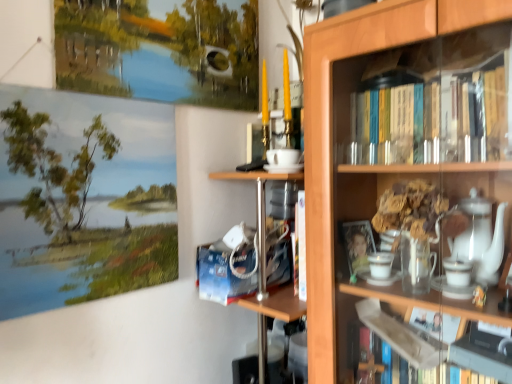
Question: Should I look upward or downward to see oil painting landscape at upper left?

Choices:
 (A) up
 (B) down

Answer: (B)

Question: Does wooden bookcase at upper right have a greater height compared to oil painting landscape at upper left?

Choices:
 (A) yes
 (B) no

Answer: (A)

Question: From a real-world perspective, is wooden bookcase at upper right under oil painting landscape at upper left?

Choices:
 (A) yes
 (B) no

Answer: (A)

Question: Is wooden bookcase at upper right positioned beyond the bounds of oil painting landscape at upper left?

Choices:
 (A) yes
 (B) no

Answer: (A)

Question: Is there a large distance between wooden bookcase at upper right and oil painting landscape at upper left?

Choices:
 (A) yes
 (B) no

Answer: (B)

Question: From the image's perspective, is wooden bookcase at upper right located above oil painting landscape at upper left?

Choices:
 (A) no
 (B) yes

Answer: (A)

Question: Are wooden bookcase at upper right and oil painting landscape at upper left beside each other?

Choices:
 (A) no
 (B) yes

Answer: (A)

Question: Does oil painting landscape at upper left come behind wooden bookcase at upper right?

Choices:
 (A) yes
 (B) no

Answer: (A)

Question: Does oil painting landscape at upper left have a larger size compared to wooden bookcase at upper right?

Choices:
 (A) yes
 (B) no

Answer: (B)

Question: Can you confirm if oil painting landscape at upper left is wider than wooden bookcase at upper right?

Choices:
 (A) yes
 (B) no

Answer: (B)

Question: Can we say oil painting landscape at upper left lies outside wooden bookcase at upper right?

Choices:
 (A) no
 (B) yes

Answer: (B)

Question: Does oil painting landscape at upper left appear on the right side of wooden bookcase at upper right?

Choices:
 (A) no
 (B) yes

Answer: (A)

Question: Is oil painting landscape at upper left closer to the viewer compared to wooden bookcase at upper right?

Choices:
 (A) no
 (B) yes

Answer: (A)

Question: Is wooden bookcase at upper right wider or thinner than oil painting landscape at upper left?

Choices:
 (A) thin
 (B) wide

Answer: (B)